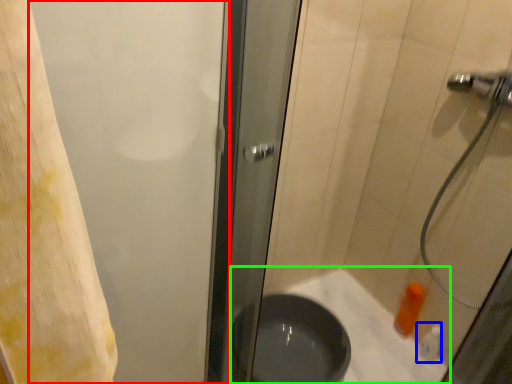
Question: Which is farther away from screen door (highlighted by a red box)? toiletry (highlighted by a blue box) or bath (highlighted by a green box)?

Choices:
 (A) toiletry
 (B) bath

Answer: (A)